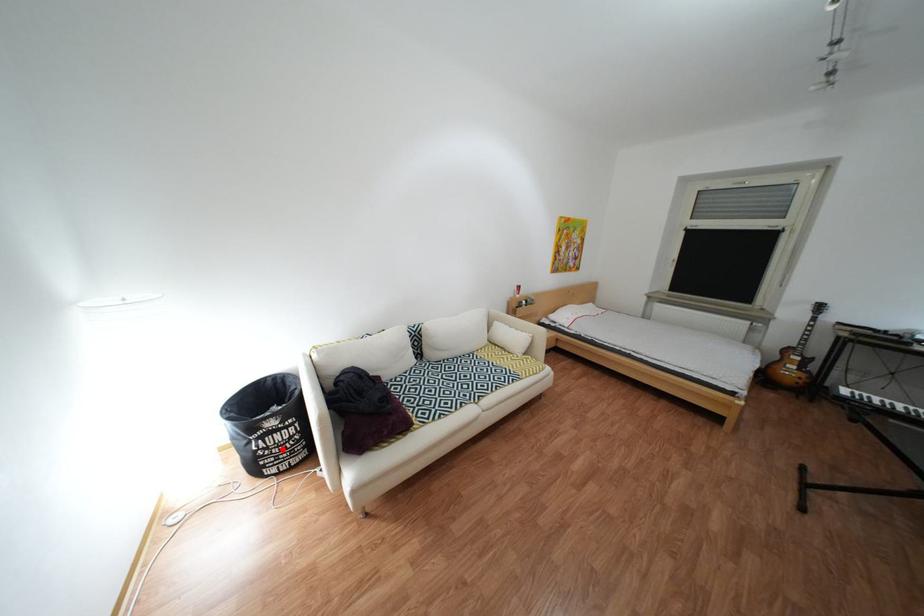
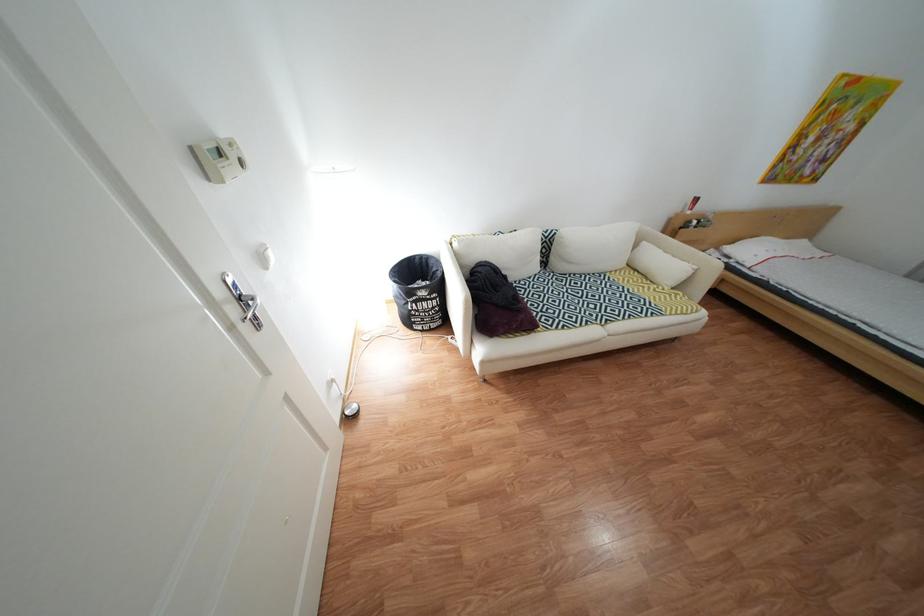
The point at the highlighted location is marked in the first image. Where is the corresponding point in the second image?

(433, 312)